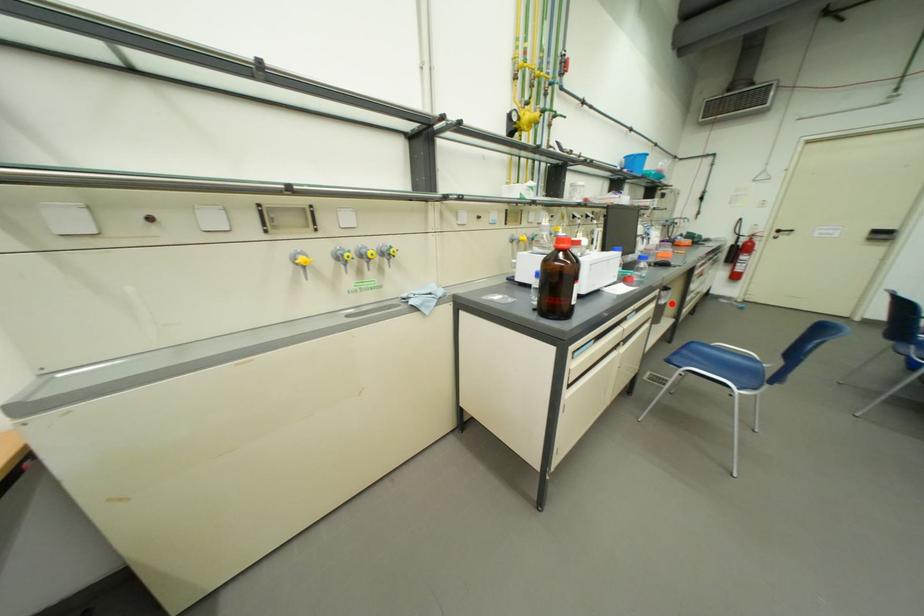
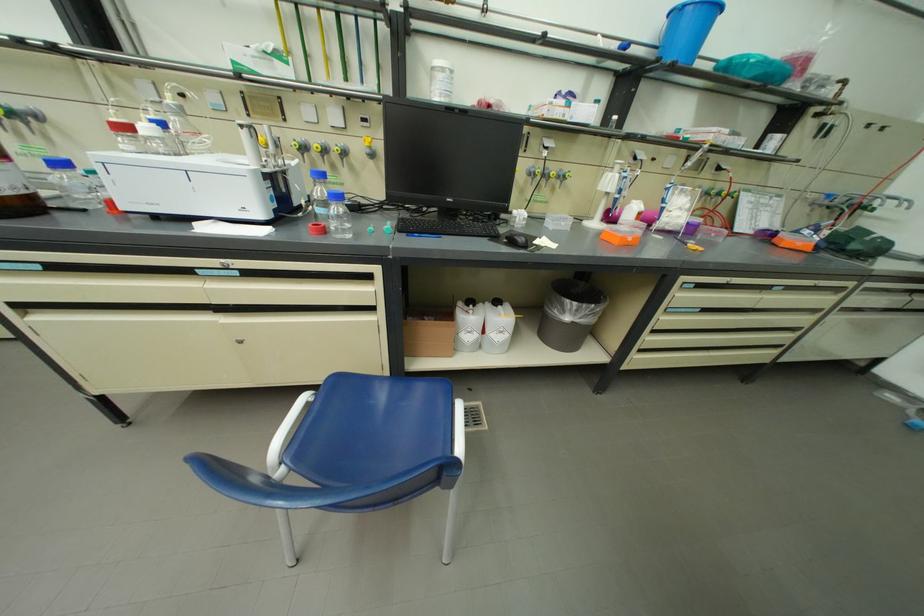
Question: I am providing you with two images of the same scene from different viewpoints. A red point is shown in image1. For the corresponding object point in image2, is it positioned nearer or farther from the camera?

Choices:
 (A) Nearer
 (B) Farther

Answer: (A)